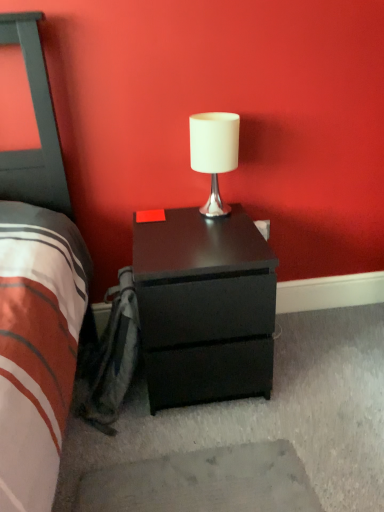
Measure the distance between point (229, 154) and camera.

→ Point (229, 154) is 1.34 meters away from camera.

Where is `white matte table lamp at center`? This screenshot has height=512, width=384. white matte table lamp at center is located at coordinates (214, 153).

Looking at this image, what is the approximate height of white matte table lamp at center?

white matte table lamp at center is 13.64 inches tall.

Describe the element at coordinates (214, 153) in the screenshot. I see `white matte table lamp at center` at that location.

The height and width of the screenshot is (512, 384). What do you see at coordinates (204, 307) in the screenshot? I see `matte black nightstand at center` at bounding box center [204, 307].

Find the location of a particular element. matte black nightstand at center is located at coordinates (204, 307).

At what (x,y) coordinates should I click in order to perform the action: click on white matte table lamp at center. Please return your answer as a coordinate pair (x, y). This screenshot has height=512, width=384. Looking at the image, I should click on (214, 153).

Considering the positions of objects white matte table lamp at center and matte black nightstand at center in the image provided, who is more to the left, white matte table lamp at center or matte black nightstand at center?

matte black nightstand at center is more to the left.

Relative to matte black nightstand at center, is white matte table lamp at center in front or behind?

white matte table lamp at center is positioned farther from the viewer than matte black nightstand at center.

Which is closer, (209,146) or (186,383)?

Point (209,146) is farther from the camera than point (186,383).

From the image's perspective, would you say white matte table lamp at center is shown under matte black nightstand at center?

No, from the image's perspective, white matte table lamp at center is not below matte black nightstand at center.

From a real-world perspective, which is physically below, white matte table lamp at center or matte black nightstand at center?

matte black nightstand at center is physically lower.

Between white matte table lamp at center and matte black nightstand at center, which one has smaller width?

Thinner between the two is white matte table lamp at center.

Which of these two, white matte table lamp at center or matte black nightstand at center, stands taller?

matte black nightstand at center.

Can you confirm if white matte table lamp at center is smaller than matte black nightstand at center?

Yes.

Is white matte table lamp at center inside or outside of matte black nightstand at center?

white matte table lamp at center exists outside the volume of matte black nightstand at center.

Are white matte table lamp at center and matte black nightstand at center making contact?

No, white matte table lamp at center is not with matte black nightstand at center.

Does white matte table lamp at center turn towards matte black nightstand at center?

No.

What's the angular difference between white matte table lamp at center and matte black nightstand at center's facing directions?

white matte table lamp at center and matte black nightstand at center are facing 0.000503 degrees away from each other.

Find the location of a particular element. This screenshot has height=512, width=384. table lamp on the right of matte black nightstand at center is located at coordinates (214, 153).

Is matte black nightstand at center to the left of white matte table lamp at center from the viewer's perspective?

Indeed, matte black nightstand at center is positioned on the left side of white matte table lamp at center.

Is matte black nightstand at center further to the viewer compared to white matte table lamp at center?

No, matte black nightstand at center is closer to the camera.

Considering the points (187, 256) and (221, 134), which point is in front, point (187, 256) or point (221, 134)?

Positioned in front is point (187, 256).

From the image's perspective, is matte black nightstand at center above or below white matte table lamp at center?

matte black nightstand at center is situated lower than white matte table lamp at center in the image.

From a real-world perspective, which object stands above the other?

white matte table lamp at center.

Is matte black nightstand at center thinner than white matte table lamp at center?

In fact, matte black nightstand at center might be wider than white matte table lamp at center.

Between matte black nightstand at center and white matte table lamp at center, which one has less height?

Standing shorter between the two is white matte table lamp at center.

Is matte black nightstand at center smaller than white matte table lamp at center?

Incorrect, matte black nightstand at center is not smaller in size than white matte table lamp at center.

In the scene shown: Is matte black nightstand at center inside the boundaries of white matte table lamp at center, or outside?

matte black nightstand at center is located beyond the bounds of white matte table lamp at center.

Is matte black nightstand at center directly adjacent to white matte table lamp at center?

No, matte black nightstand at center is not beside white matte table lamp at center.

Is matte black nightstand at center facing towards white matte table lamp at center?

No, matte black nightstand at center is not oriented towards white matte table lamp at center.

What's the angular difference between matte black nightstand at center and white matte table lamp at center's facing directions?

0.000503 degrees separate the facing orientations of matte black nightstand at center and white matte table lamp at center.

Where is `nightstand below the white matte table lamp at center (from a real-world perspective)`? The width and height of the screenshot is (384, 512). nightstand below the white matte table lamp at center (from a real-world perspective) is located at coordinates (204, 307).

Find the location of a particular element. nightstand that is on the left side of white matte table lamp at center is located at coordinates (204, 307).

The image size is (384, 512). I want to click on nightstand beneath the white matte table lamp at center (from a real-world perspective), so click(204, 307).